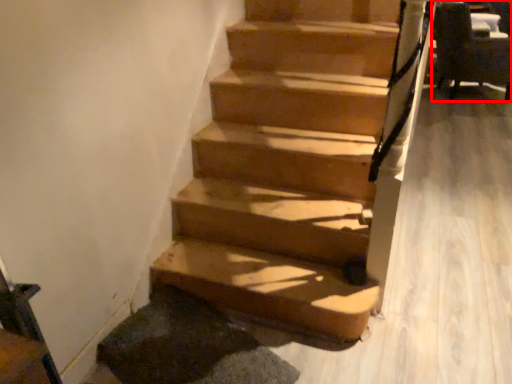
Question: From the image's perspective, where is armchair (annotated by the red box) located relative to stairs?

Choices:
 (A) above
 (B) below

Answer: (A)